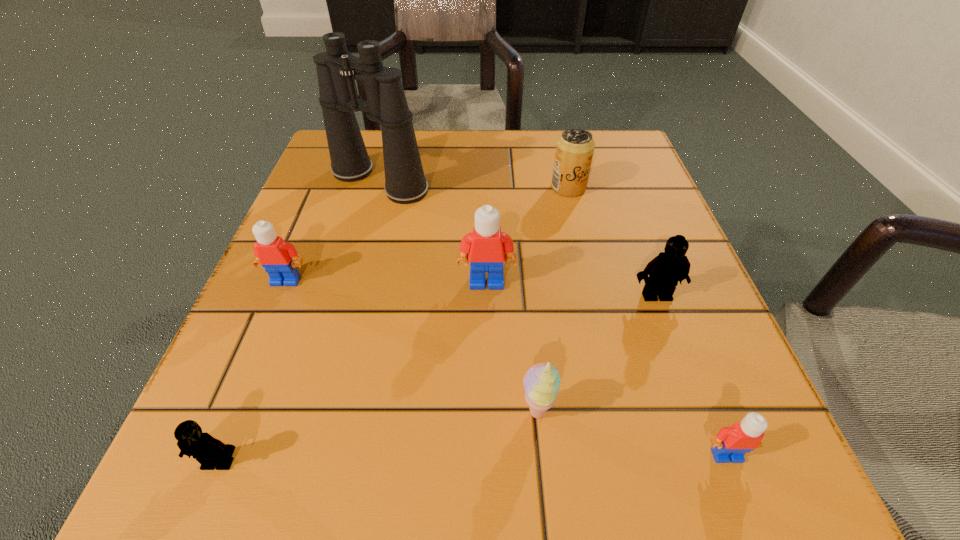
At what (x,y) coordinates should I click in order to perform the action: click on the nearest white Lego. Please return your answer as a coordinate pair (x, y). Looking at the image, I should click on (731, 443).

Identify the location of the smallest white Lego. Image resolution: width=960 pixels, height=540 pixels. (731, 443).

Find the location of `vacant area situated on the front of the tallest object`. vacant area situated on the front of the tallest object is located at coordinates [x=360, y=250].

You are a GUI agent. You are given a task and a screenshot of the screen. Output one action in this format:
    pyautogui.click(x=<x>, y=<y>)
    Task: Click on the blank space located 0.300m on the face of the third Lego from left to right
    The width and height of the screenshot is (960, 540).
    Given the screenshot: What is the action you would take?
    pyautogui.click(x=490, y=488)

Where is `vacant space located 0.150m on the front of the beer can`? vacant space located 0.150m on the front of the beer can is located at coordinates (584, 249).

This screenshot has width=960, height=540. In order to click on free space located on the face of the right black Lego in this screenshot , I will do `click(679, 357)`.

The image size is (960, 540). In order to click on blank area located 0.210m on the face of the second biggest white Lego in this screenshot , I will do `click(232, 407)`.

Identify the location of free location located on the right of the third nearest object. [679, 413].

Where is `binoculars that is at the far edge`? binoculars that is at the far edge is located at coordinates (405, 183).

Identify the location of beer can that is positioned at the far edge. The height and width of the screenshot is (540, 960). (574, 150).